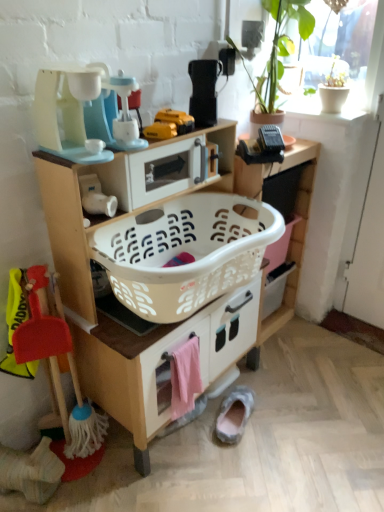
Question: Is white plastic laundry basket at center further to camera compared to gray suede slipper at lower center?

Choices:
 (A) yes
 (B) no

Answer: (B)

Question: Is white plastic laundry basket at center to the left of gray suede slipper at lower center from the viewer's perspective?

Choices:
 (A) no
 (B) yes

Answer: (B)

Question: From the image's perspective, would you say white plastic laundry basket at center is positioned over gray suede slipper at lower center?

Choices:
 (A) yes
 (B) no

Answer: (A)

Question: Is white plastic laundry basket at center wider than gray suede slipper at lower center?

Choices:
 (A) yes
 (B) no

Answer: (A)

Question: Is white plastic laundry basket at center looking in the opposite direction of gray suede slipper at lower center?

Choices:
 (A) yes
 (B) no

Answer: (B)

Question: Is white plastic laundry basket at center surrounding gray suede slipper at lower center?

Choices:
 (A) yes
 (B) no

Answer: (B)

Question: Is white plastic laundry basket at center wider than white matte pot at upper right?

Choices:
 (A) no
 (B) yes

Answer: (B)

Question: Is white plastic laundry basket at center in front of white matte pot at upper right?

Choices:
 (A) yes
 (B) no

Answer: (A)

Question: Does white plastic laundry basket at center have a smaller size compared to white matte pot at upper right?

Choices:
 (A) yes
 (B) no

Answer: (B)

Question: Is white plastic laundry basket at center far from white matte pot at upper right?

Choices:
 (A) yes
 (B) no

Answer: (B)

Question: Does white plastic laundry basket at center appear on the left side of white matte pot at upper right?

Choices:
 (A) no
 (B) yes

Answer: (B)

Question: Is the depth of white plastic laundry basket at center greater than that of white matte pot at upper right?

Choices:
 (A) yes
 (B) no

Answer: (B)

Question: Could you tell me if white plastic laundry basket at center is facing matte plastic toy coffee maker at upper left, the first appliance viewed from the left?

Choices:
 (A) no
 (B) yes

Answer: (A)